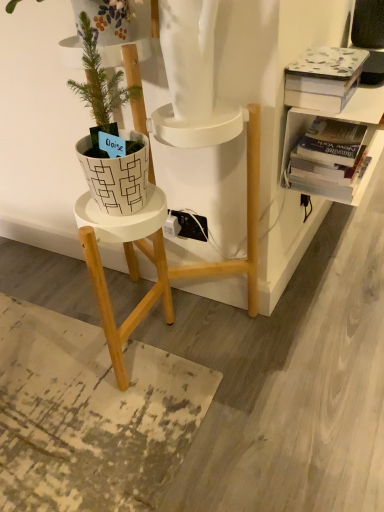
What do you see at coordinates (324, 78) in the screenshot?
I see `white textured book at upper right, the first book when ordered from top to bottom` at bounding box center [324, 78].

In order to click on white textured book at upper right, the first book when ordered from top to bottom in this screenshot , I will do `click(324, 78)`.

In the scene shown: Considering the sizes of objects hardcover book at upper right, placed as the second book when sorted from top to bottom, and white matte pot at left in the image provided, who is wider, hardcover book at upper right, placed as the second book when sorted from top to bottom, or white matte pot at left?

hardcover book at upper right, placed as the second book when sorted from top to bottom.

In the scene shown: Is hardcover book at upper right, placed as the second book when sorted from top to bottom, facing towards white matte pot at left?

No, hardcover book at upper right, placed as the second book when sorted from top to bottom, is not facing towards white matte pot at left.

Locate an element on the screen. houseplant on the left of hardcover book at upper right, placed as the first book when sorted from bottom to top is located at coordinates (109, 134).

Is white textured book at upper right, the first book when ordered from top to bottom, next to white matte pot at left and touching it?

They are not placed beside each other.

Locate an element on the screen. book that is the 2nd one when counting upward from the white matte pot at left (from the image's perspective) is located at coordinates (324, 78).

Which is behind, white textured book at upper right, the first book when ordered from top to bottom, or white matte pot at left?

white textured book at upper right, the first book when ordered from top to bottom.

Which is more to the left, white textured book at upper right, the first book when ordered from top to bottom, or white matte pot at left?

From the viewer's perspective, white matte pot at left appears more on the left side.

From a real-world perspective, is white matte pot at left on hardcover book at upper right, placed as the second book when sorted from top to bottom?

Yes, from a real-world perspective, white matte pot at left is on top of hardcover book at upper right, placed as the second book when sorted from top to bottom.

From the image's perspective, is white matte pot at left located beneath hardcover book at upper right, placed as the second book when sorted from top to bottom?

Yes, from the image's perspective, white matte pot at left is below hardcover book at upper right, placed as the second book when sorted from top to bottom.

Which of these two, white matte pot at left or hardcover book at upper right, placed as the first book when sorted from bottom to top, is bigger?

white matte pot at left.

Considering the relative sizes of white matte pot at left and hardcover book at upper right, placed as the first book when sorted from bottom to top, in the image provided, is white matte pot at left thinner than hardcover book at upper right, placed as the first book when sorted from bottom to top,?

Indeed, white matte pot at left has a lesser width compared to hardcover book at upper right, placed as the first book when sorted from bottom to top.

Looking at this image, is white matte pot at left not inside white textured book at upper right, the 2th book from the bottom?

Yes.

How different are the orientations of white matte pot at left and white textured book at upper right, the first book when ordered from top to bottom, in degrees?

The angle between the facing direction of white matte pot at left and the facing direction of white textured book at upper right, the first book when ordered from top to bottom, is 90.1 degrees.

Is white matte pot at left bigger or smaller than white textured book at upper right, the first book when ordered from top to bottom?

In the image, white matte pot at left appears to be larger than white textured book at upper right, the first book when ordered from top to bottom.

Measure the distance between white matte pot at left and white textured book at upper right, the 2th book from the bottom.

A distance of 16.56 inches exists between white matte pot at left and white textured book at upper right, the 2th book from the bottom.

Is point (363, 170) farther from camera compared to point (334, 103)?

Yes, it is.

Who is smaller, hardcover book at upper right, placed as the second book when sorted from top to bottom, or white textured book at upper right, the first book when ordered from top to bottom?

hardcover book at upper right, placed as the second book when sorted from top to bottom, is smaller.

Is hardcover book at upper right, placed as the second book when sorted from top to bottom, oriented towards white textured book at upper right, the first book when ordered from top to bottom?

No, hardcover book at upper right, placed as the second book when sorted from top to bottom, is not aimed at white textured book at upper right, the first book when ordered from top to bottom.

Considering the positions of objects hardcover book at upper right, placed as the first book when sorted from bottom to top, and white textured book at upper right, the first book when ordered from top to bottom, in the image provided, who is behind, hardcover book at upper right, placed as the first book when sorted from bottom to top, or white textured book at upper right, the first book when ordered from top to bottom,?

hardcover book at upper right, placed as the first book when sorted from bottom to top, is behind.

Looking at this image, is white textured book at upper right, the 2th book from the bottom, next to hardcover book at upper right, placed as the first book when sorted from bottom to top?

white textured book at upper right, the 2th book from the bottom, and hardcover book at upper right, placed as the first book when sorted from bottom to top, are clearly separated.

Which of these two, white textured book at upper right, the first book when ordered from top to bottom, or hardcover book at upper right, placed as the second book when sorted from top to bottom, stands shorter?

hardcover book at upper right, placed as the second book when sorted from top to bottom.

How different are the orientations of white textured book at upper right, the first book when ordered from top to bottom, and hardcover book at upper right, placed as the first book when sorted from bottom to top, in degrees?

0.00231 degrees separate the facing orientations of white textured book at upper right, the first book when ordered from top to bottom, and hardcover book at upper right, placed as the first book when sorted from bottom to top.

From the image's perspective, is white textured book at upper right, the first book when ordered from top to bottom, under hardcover book at upper right, placed as the first book when sorted from bottom to top?

No, from the image's perspective, white textured book at upper right, the first book when ordered from top to bottom, is not below hardcover book at upper right, placed as the first book when sorted from bottom to top.

Locate an element on the screen. The height and width of the screenshot is (512, 384). houseplant that appears on the left of hardcover book at upper right, placed as the second book when sorted from top to bottom is located at coordinates (109, 134).

Locate an element on the screen. The width and height of the screenshot is (384, 512). houseplant in front of the white textured book at upper right, the 2th book from the bottom is located at coordinates (109, 134).

When comparing their distances from white matte pot at left, does white textured book at upper right, the first book when ordered from top to bottom, or hardcover book at upper right, placed as the second book when sorted from top to bottom, seem further?

hardcover book at upper right, placed as the second book when sorted from top to bottom.

From the image, which object appears to be nearer to white matte pot at left, hardcover book at upper right, placed as the second book when sorted from top to bottom, or white textured book at upper right, the 2th book from the bottom?

white textured book at upper right, the 2th book from the bottom, is closer to white matte pot at left.

From the image, which object appears to be nearer to white textured book at upper right, the first book when ordered from top to bottom, hardcover book at upper right, placed as the second book when sorted from top to bottom, or white matte pot at left?

The object closer to white textured book at upper right, the first book when ordered from top to bottom, is hardcover book at upper right, placed as the second book when sorted from top to bottom.

Based on their spatial positions, is white textured book at upper right, the 2th book from the bottom, or white matte pot at left further from hardcover book at upper right, placed as the second book when sorted from top to bottom?

Among the two, white matte pot at left is located further to hardcover book at upper right, placed as the second book when sorted from top to bottom.

Considering their positions, is white matte pot at left positioned closer to hardcover book at upper right, placed as the first book when sorted from bottom to top, than white textured book at upper right, the first book when ordered from top to bottom?

white textured book at upper right, the first book when ordered from top to bottom, is positioned closer to the anchor hardcover book at upper right, placed as the first book when sorted from bottom to top.

When comparing their distances from white textured book at upper right, the 2th book from the bottom, does white matte pot at left or hardcover book at upper right, placed as the second book when sorted from top to bottom, seem closer?

hardcover book at upper right, placed as the second book when sorted from top to bottom, is closer to white textured book at upper right, the 2th book from the bottom.

Image resolution: width=384 pixels, height=512 pixels. I want to click on book between white matte pot at left and hardcover book at upper right, placed as the second book when sorted from top to bottom, in the horizontal direction, so click(x=324, y=78).